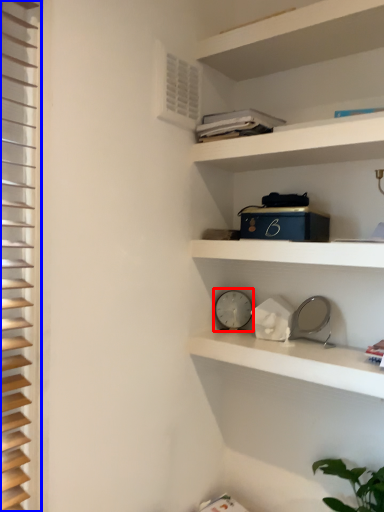
Question: Which object appears closest to the camera in this image, clock (highlighted by a red box) or shutter (highlighted by a blue box)?

Choices:
 (A) clock
 (B) shutter

Answer: (B)